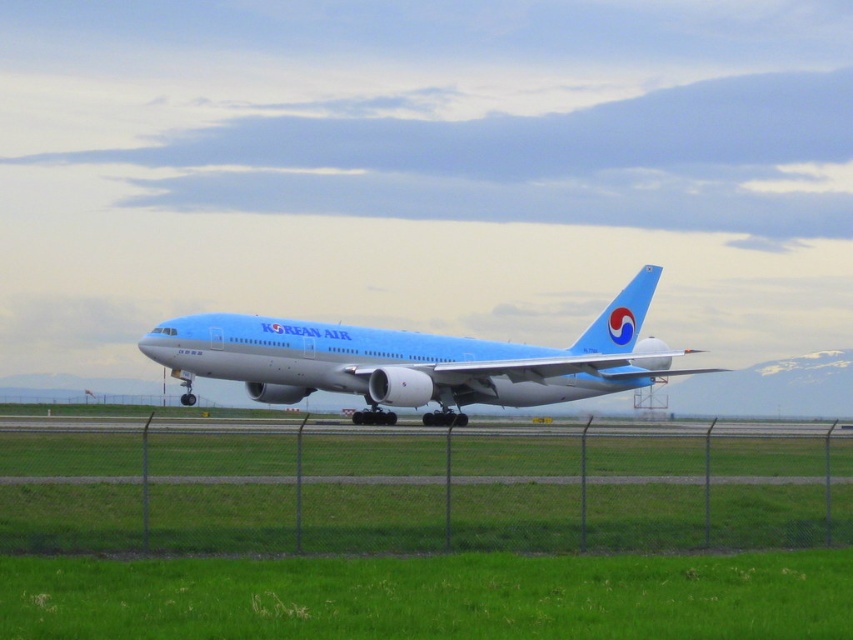
Which is behind, point (335, 513) or point (135, 573)?

Positioned behind is point (335, 513).

Which is below, metallic chain-link fence at lower center or green grass at lower center?

metallic chain-link fence at lower center is lower down.

What do you see at coordinates (418, 490) in the screenshot? I see `metallic chain-link fence at lower center` at bounding box center [418, 490].

Identify the location of metallic chain-link fence at lower center. Image resolution: width=853 pixels, height=640 pixels. (418, 490).

Does metallic chain-link fence at lower center appear on the right side of light blue matte airplane at center?

Incorrect, metallic chain-link fence at lower center is not on the right side of light blue matte airplane at center.

Can you confirm if metallic chain-link fence at lower center is bigger than light blue matte airplane at center?

Actually, metallic chain-link fence at lower center might be smaller than light blue matte airplane at center.

Does point (581, 502) come closer to viewer compared to point (444, 376)?

Yes, point (581, 502) is in front of point (444, 376).

Find the location of a particular element. metallic chain-link fence at lower center is located at coordinates (418, 490).

This screenshot has width=853, height=640. Describe the element at coordinates (431, 596) in the screenshot. I see `green grass at lower center` at that location.

Between point (672, 621) and point (595, 321), which one is positioned behind?

The point (595, 321) is more distant.

Is point (244, 602) more distant than point (397, 380)?

No, (244, 602) is closer to viewer.

Locate an element on the screen. green grass at lower center is located at coordinates (431, 596).